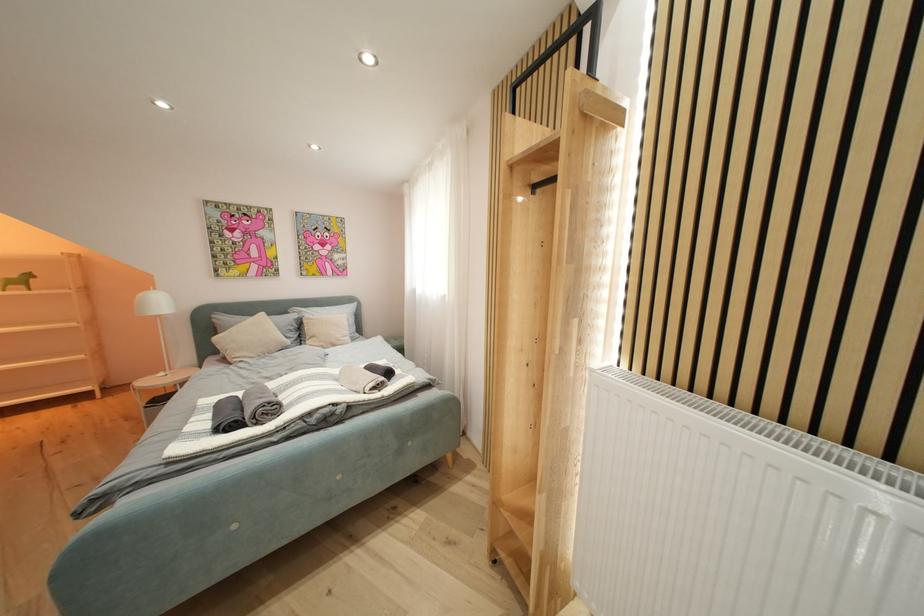
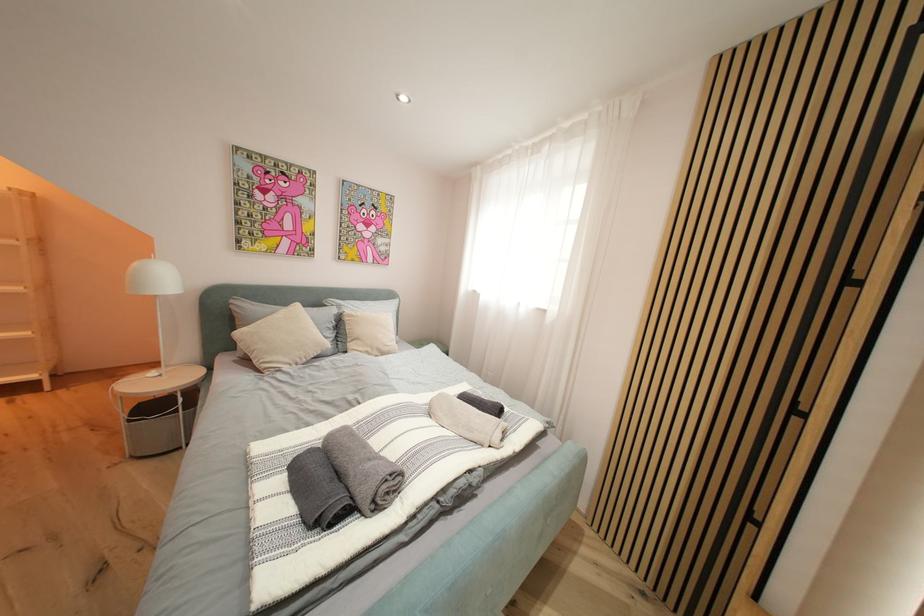
Which direction would the cameraman need to move to produce the second image?

The movement direction of the cameraman is left, forward.